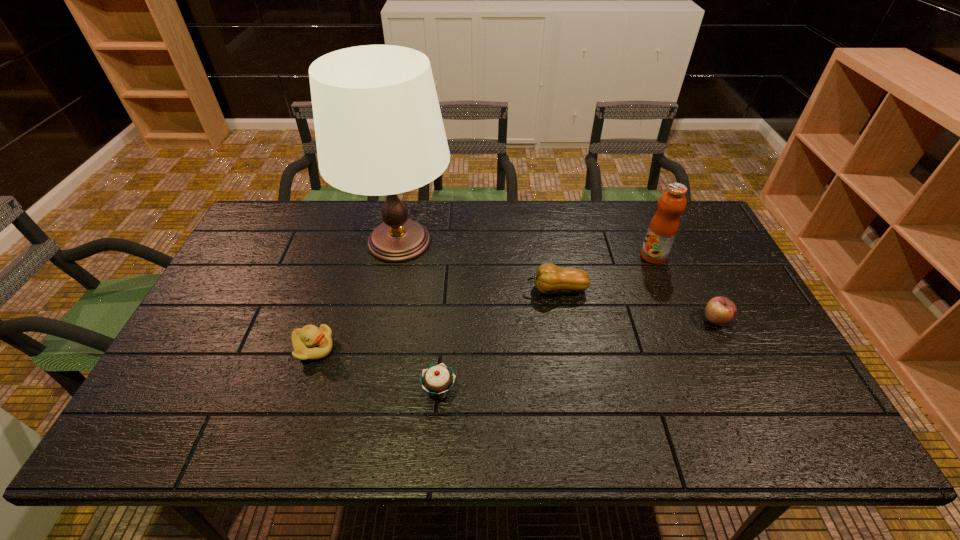
Where is `lamp`? lamp is located at coordinates (379, 131).

Locate an element on the screen. The image size is (960, 540). the second object from right to left is located at coordinates (664, 225).

Locate an element on the screen. the second tallest object is located at coordinates (664, 225).

Identify the location of the fourth object from left to right. (549, 278).

Find the location of a particular element. The image size is (960, 540). the rightmost object is located at coordinates (720, 311).

At what (x,y) coordinates should I click in order to perform the action: click on apple. Please return your answer as a coordinate pair (x, y). The image size is (960, 540). Looking at the image, I should click on (720, 311).

Where is `duckling`? duckling is located at coordinates (310, 342).

Identify the location of the nearest object. (438, 379).

This screenshot has height=540, width=960. What are the coordinates of `blank area located 0.210m on the right of the lamp` in the screenshot? It's located at (517, 241).

Identify the location of free space located on the front label of the second tallest object. (556, 256).